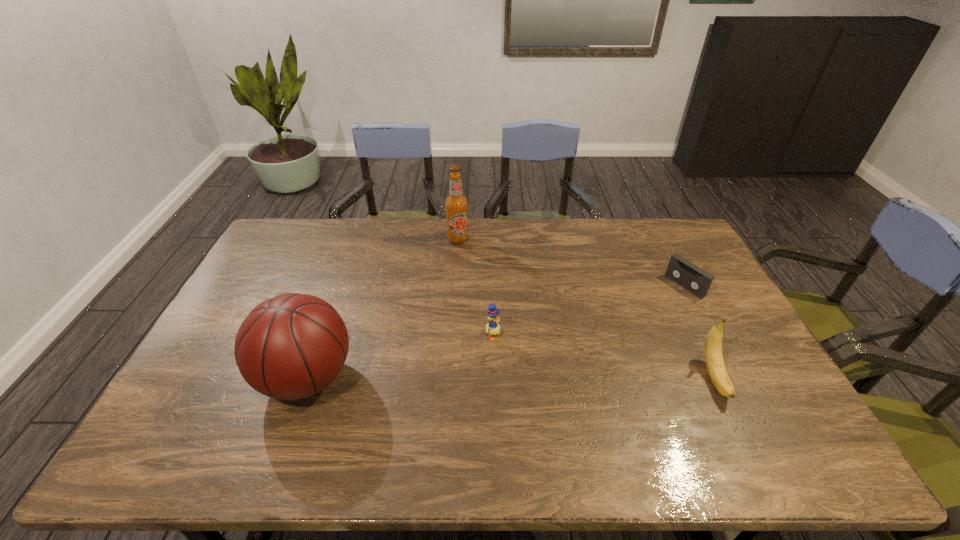
Locate an element on the screen. Image resolution: width=960 pixels, height=540 pixels. basketball is located at coordinates (289, 347).

Locate an element on the screen. This screenshot has width=960, height=540. the third tallest object is located at coordinates (713, 345).

The height and width of the screenshot is (540, 960). I want to click on the shortest object, so pos(681,271).

Image resolution: width=960 pixels, height=540 pixels. I want to click on the fourth nearest object, so click(x=681, y=271).

You are a GUI agent. You are given a task and a screenshot of the screen. Output one action in this format:
    pyautogui.click(x=<x>, y=<y>)
    Task: Click on the fourth tallest object
    
    Given the screenshot: What is the action you would take?
    pyautogui.click(x=493, y=328)

The image size is (960, 540). What are the coordinates of `the third object from right to left` in the screenshot? It's located at (493, 328).

Locate an element on the screen. The width and height of the screenshot is (960, 540). beer bottle is located at coordinates (456, 204).

This screenshot has width=960, height=540. What are the coordinates of `the fourth object from right to left` in the screenshot? It's located at (456, 204).

At what (x,y) coordinates should I click in order to perform the action: click on vacant space located on the back of the leftmost object. Please return your answer as a coordinate pair (x, y). This screenshot has height=540, width=960. Looking at the image, I should click on (340, 285).

Image resolution: width=960 pixels, height=540 pixels. Find the location of `vacant space located 0.350m on the front-facing side of the second farthest object`. vacant space located 0.350m on the front-facing side of the second farthest object is located at coordinates (599, 340).